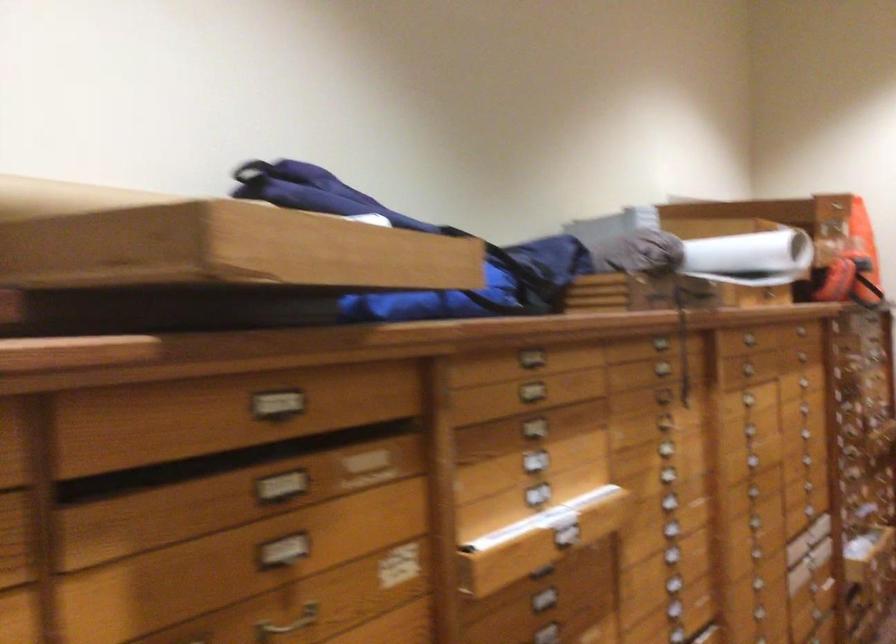
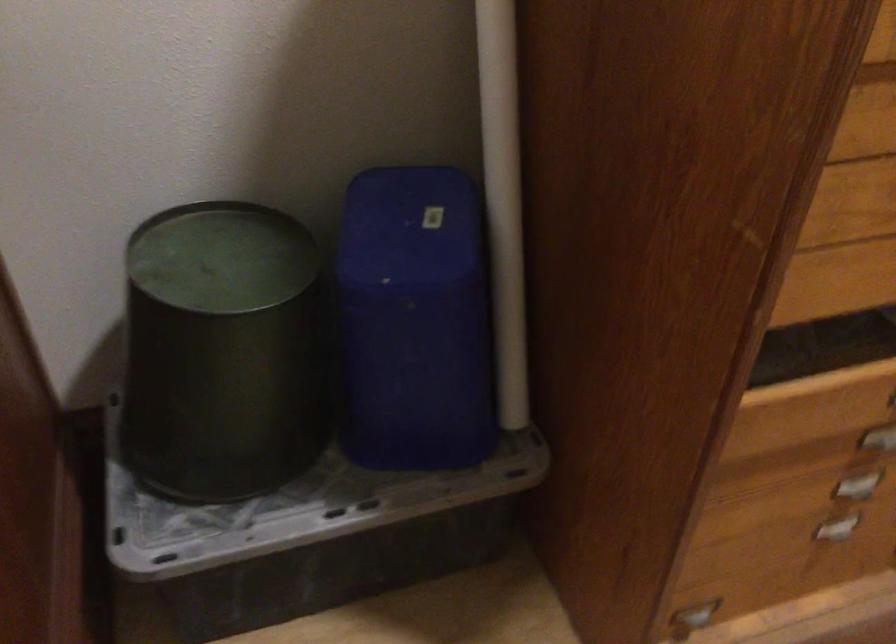
Looking at this image, the first image is from the beginning of the video and the second image is from the end. How did the camera likely rotate when shooting the video?

The camera's rotation is toward left-down.